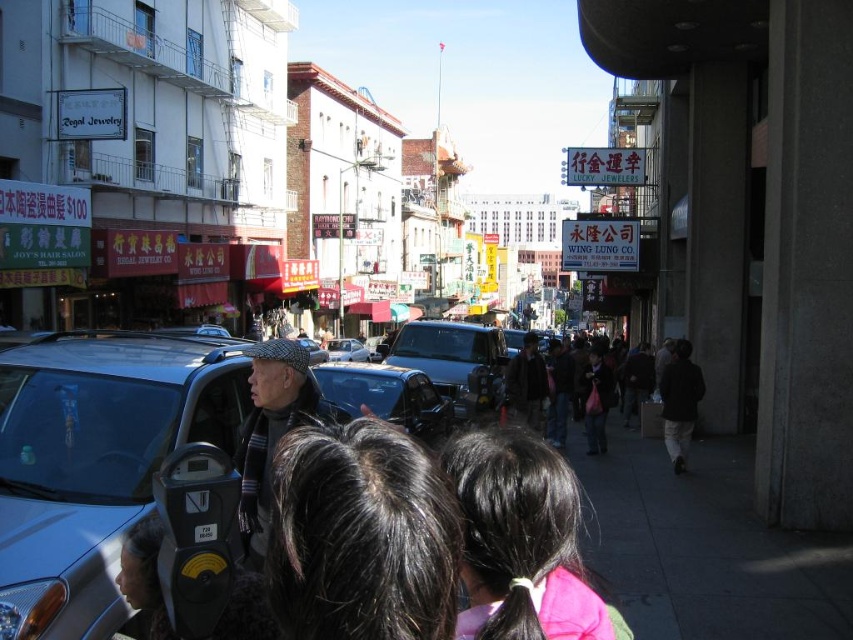
You are standing on the sidewalk in the bustling urban street scene described. You notice a person with dark brown hair at center. Can you determine the exact coordinates of where this person is located?

The dark brown hair at center is located at point (x=361, y=536).

You are standing at the point marked as point [386,396] in the image. What object are you directly facing?

The point [386,396] corresponds to the metallic blue taxi at center, so you are directly facing the metallic blue taxi at center.